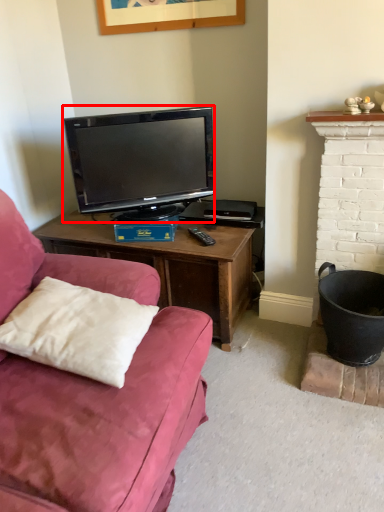
Question: From the image's perspective, considering the relative positions of television (annotated by the red box) and pillow in the image provided, where is television (annotated by the red box) located with respect to the staircase?

Choices:
 (A) below
 (B) above

Answer: (B)